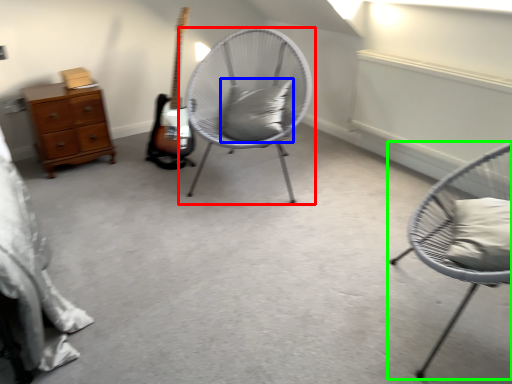
Question: Based on their relative distances, which object is nearer to chair (highlighted by a red box)? Choose from pillow (highlighted by a blue box) and chair (highlighted by a green box).

Choices:
 (A) pillow
 (B) chair

Answer: (A)